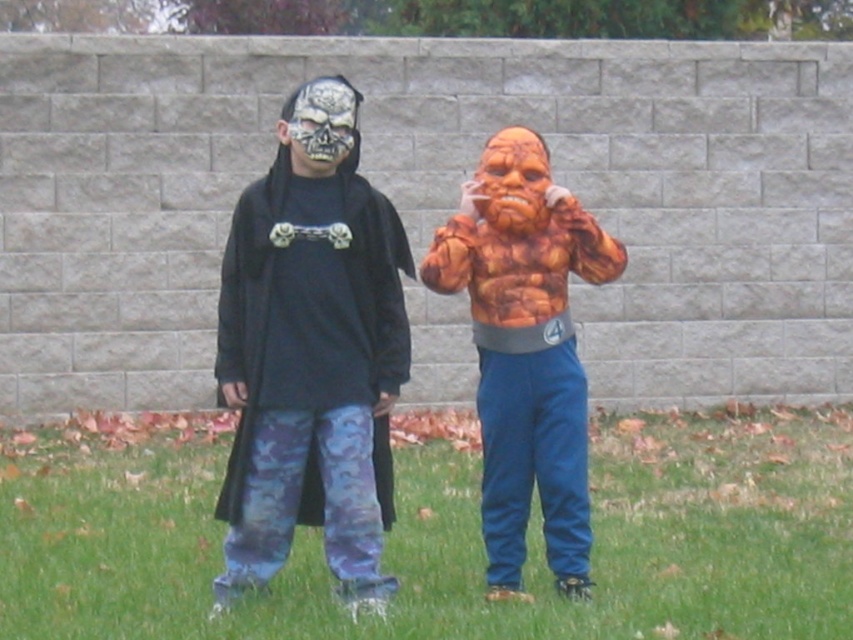
Between matte black t-shirt at center and rubberized orange mask at center, which one appears on the left side from the viewer's perspective?

From the viewer's perspective, matte black t-shirt at center appears more on the left side.

In the scene shown: Which of these two, matte black t-shirt at center or rubberized orange mask at center, stands shorter?

Standing shorter between the two is rubberized orange mask at center.

Does point (299, 483) come closer to viewer compared to point (538, 209)?

Yes, it is in front of point (538, 209).

Locate an element on the screen. The height and width of the screenshot is (640, 853). matte black t-shirt at center is located at coordinates (311, 353).

Can you confirm if matte black t-shirt at center is wider than shiny silver skull mask at center?

Indeed, matte black t-shirt at center has a greater width compared to shiny silver skull mask at center.

Does point (270, 412) come behind point (306, 122)?

That is True.

This screenshot has width=853, height=640. What do you see at coordinates (311, 353) in the screenshot?
I see `matte black t-shirt at center` at bounding box center [311, 353].

Where is `matte black t-shirt at center`? This screenshot has height=640, width=853. matte black t-shirt at center is located at coordinates (311, 353).

Locate an element on the screen. This screenshot has width=853, height=640. rubberized orange mask at center is located at coordinates (514, 180).

Does rubberized orange mask at center appear on the left side of shiny silver skull mask at center?

Incorrect, rubberized orange mask at center is not on the left side of shiny silver skull mask at center.

Does point (529, 225) lie behind point (354, 106)?

Yes, it is.

Locate an element on the screen. rubberized orange mask at center is located at coordinates (514, 180).